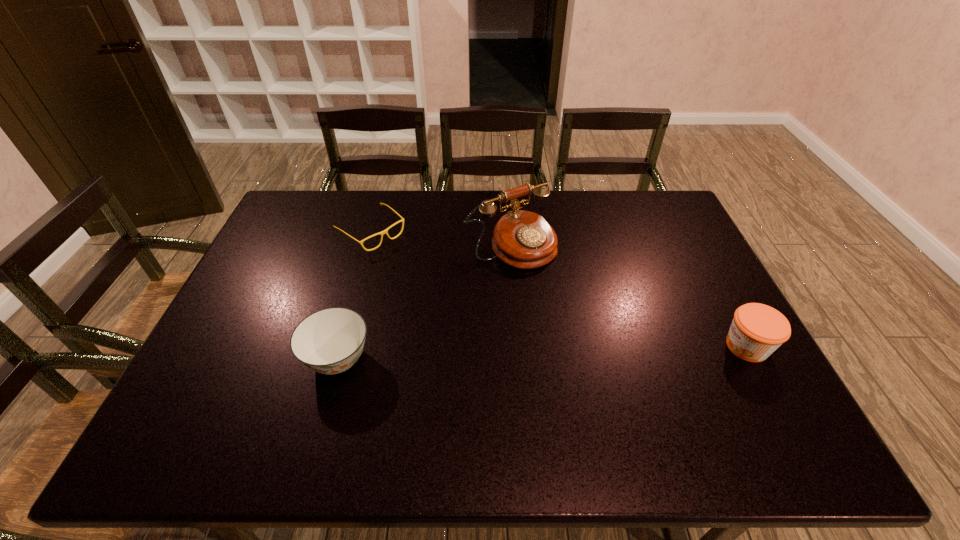
You are a GUI agent. You are given a task and a screenshot of the screen. Output one action in this format:
    pyautogui.click(x=<x>, y=<y>)
    Task: Click on the free spot on the desktop that is between the soup bowl and the rightmost object and is positioned in front of the lenses of the shortest object
    This screenshot has width=960, height=540.
    Given the screenshot: What is the action you would take?
    pyautogui.click(x=527, y=353)

Find the location of a particular element. Image resolution: width=960 pixels, height=540 pixels. vacant space on the desktop that is between the soup bowl and the jam and is positioned on the dial of the third object from left to right is located at coordinates (605, 351).